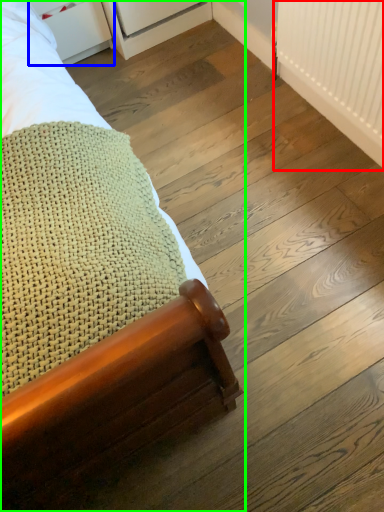
Question: Based on their relative distances, which object is farther from radiator (highlighted by a red box)? Choose from drawer (highlighted by a blue box) and bed (highlighted by a green box).

Choices:
 (A) drawer
 (B) bed

Answer: (A)